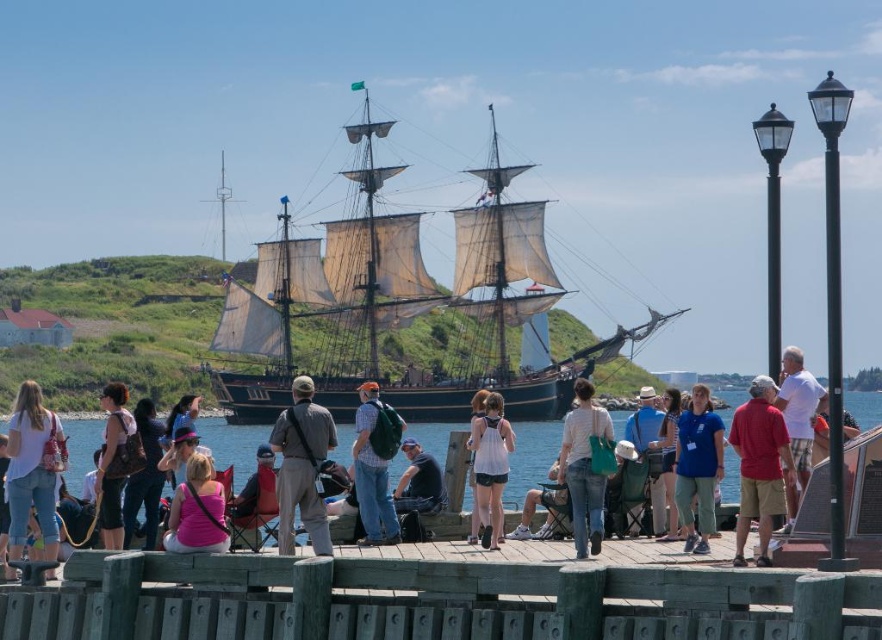
Question: Estimate the real-world distances between objects in this image. Which object is closer to the plaid shirt at center?

Choices:
 (A) white cotton shirt at right
 (B) white cotton tank top at center

Answer: (B)

Question: Which point is closer to the camera taking this photo?

Choices:
 (A) (230, 276)
 (B) (663, 436)
 (C) (50, 516)
 (D) (113, 504)

Answer: (C)

Question: In this image, where is plaid shirt at center located relative to white cotton shirt at right?

Choices:
 (A) above
 (B) below

Answer: (B)

Question: Which point is closer to the camera?

Choices:
 (A) (653, 524)
 (B) (27, 612)
 (C) (613, 436)
 (D) (118, 488)

Answer: (B)

Question: Is white cotton shirt at lower left bigger than leather backpack at center?

Choices:
 (A) no
 (B) yes

Answer: (B)

Question: Can you confirm if red cotton shirt at right is positioned to the left of matte brown backpack at center?

Choices:
 (A) yes
 (B) no

Answer: (B)